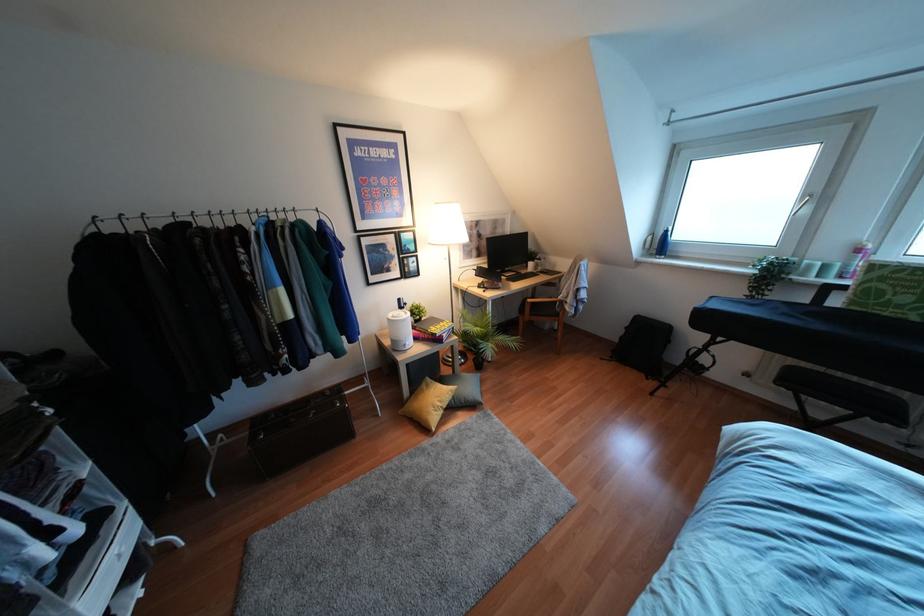
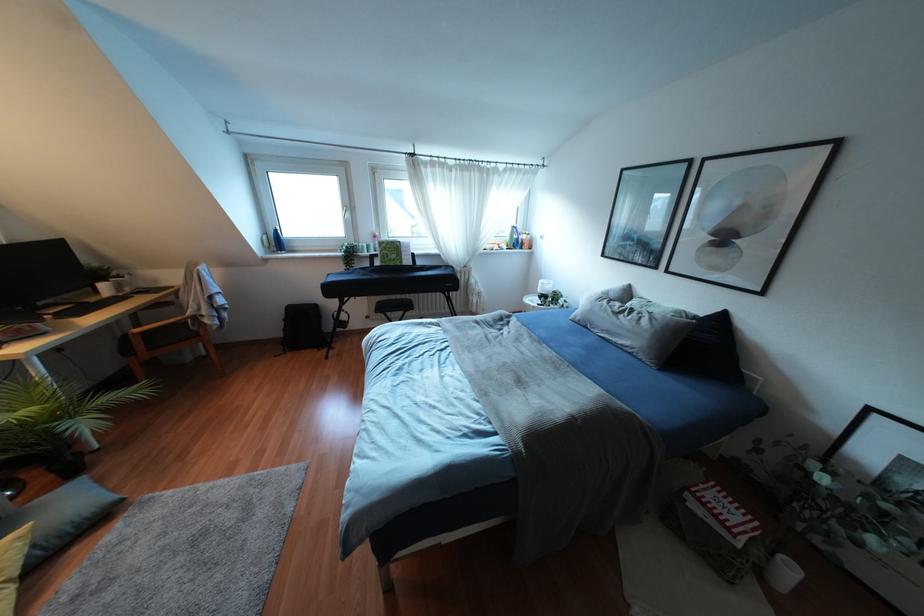
The point at [660,245] is marked in the first image. Where is the corresponding point in the second image?

(275, 241)